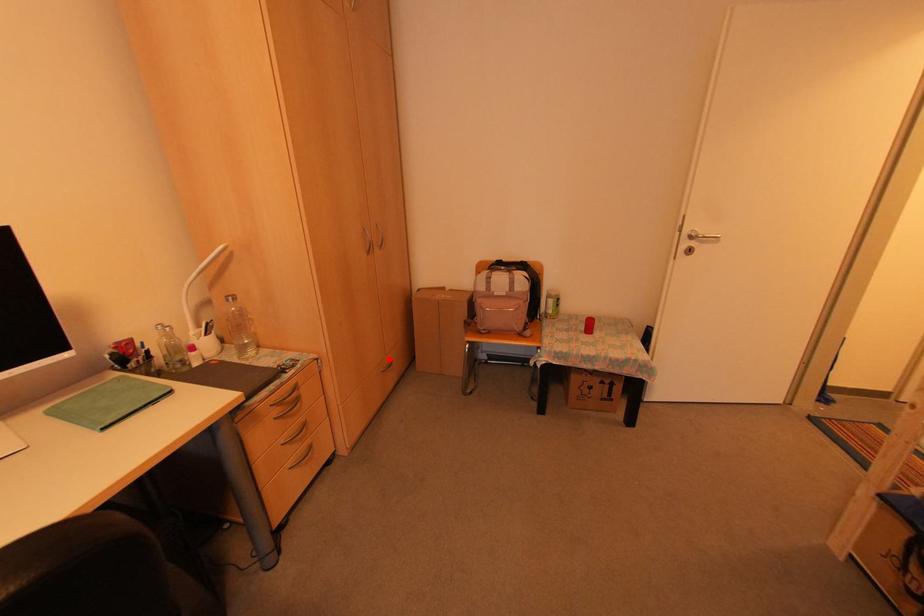
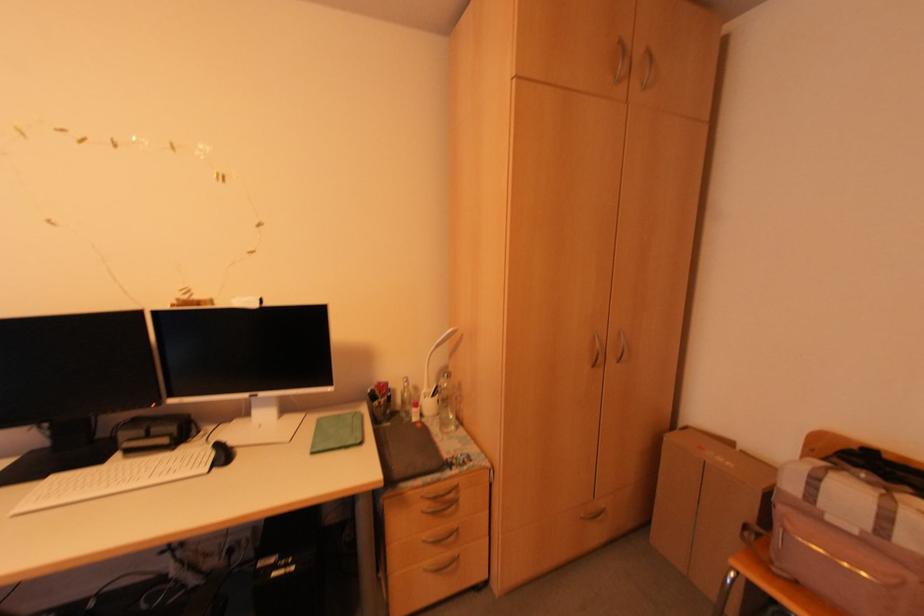
Question: I am providing you with two images of the same scene from different viewpoints. Given a red point in image1, look at the same physical point in image2. Is it:

Choices:
 (A) Closer to the viewpoint
 (B) Farther from the viewpoint

Answer: (B)